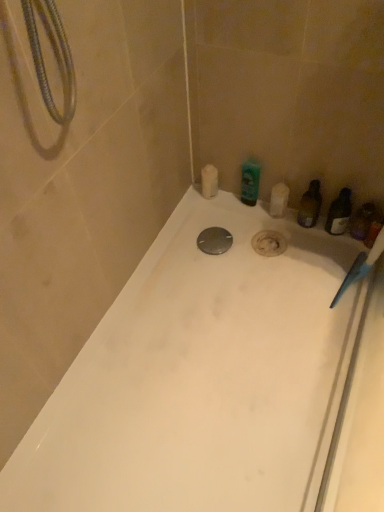
The image size is (384, 512). Find the location of `free space behind metallic silver drain at center`. free space behind metallic silver drain at center is located at coordinates (215, 222).